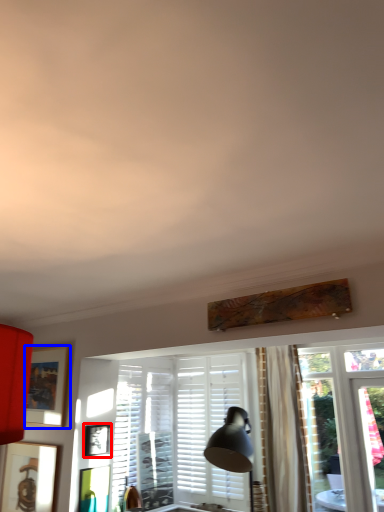
Question: Which object appears farthest to the camera in this image, picture frame (highlighted by a red box) or picture frame (highlighted by a blue box)?

Choices:
 (A) picture frame
 (B) picture frame

Answer: (B)